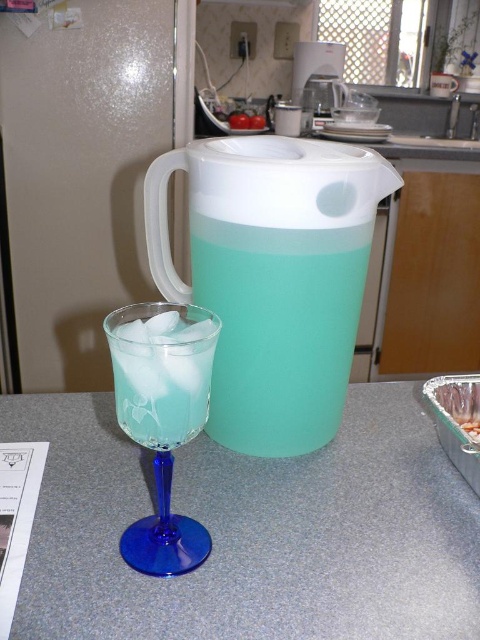
You are a delivery person who needs to place a package that is 8 inches wide on the kitchen countertop. You see the translucent plastic pitcher at center and the translucent plastic food at lower right. Can you fit the package between them without moving any objects?

The distance between the translucent plastic pitcher at center and the translucent plastic food at lower right is 7.69 inches. Since the package is 8 inches wide, it cannot fit between them without moving any objects.

You are organizing items on the kitchen countertop and need to place a new item between the translucent plastic food at lower right and the white plastic blender at upper center. Based on their positions, where should you place the new item?

The new item should be placed to the right of the translucent plastic food at lower right and to the left of the white plastic blender at upper center since the translucent plastic food at lower right is positioned to the left of the white plastic blender at upper center.